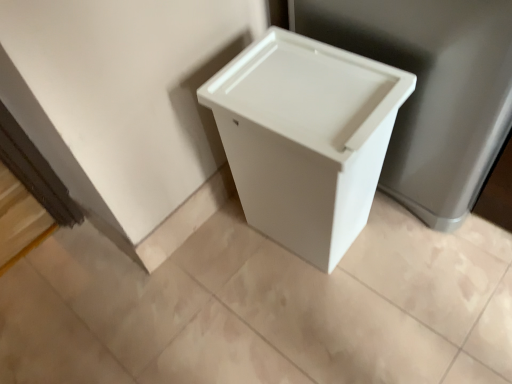
Question: From a real-world perspective, is white plastic trash can at center physically located above or below white plastic waste container at center?

Choices:
 (A) below
 (B) above

Answer: (B)

Question: Considering the positions of white plastic trash can at center and white plastic waste container at center in the image, is white plastic trash can at center wider or thinner than white plastic waste container at center?

Choices:
 (A) wide
 (B) thin

Answer: (A)

Question: Is white plastic trash can at center to the left or to the right of white plastic waste container at center in the image?

Choices:
 (A) left
 (B) right

Answer: (B)

Question: From a real-world perspective, is white plastic waste container at center positioned above or below white plastic trash can at center?

Choices:
 (A) below
 (B) above

Answer: (A)

Question: Considering the relative positions of white plastic waste container at center and white plastic trash can at center in the image provided, is white plastic waste container at center to the left or to the right of white plastic trash can at center?

Choices:
 (A) right
 (B) left

Answer: (B)

Question: Is point (279, 96) positioned closer to the camera than point (473, 38)?

Choices:
 (A) farther
 (B) closer

Answer: (A)

Question: In the image, is white plastic waste container at center positioned in front of or behind white plastic trash can at center?

Choices:
 (A) front
 (B) behind

Answer: (B)